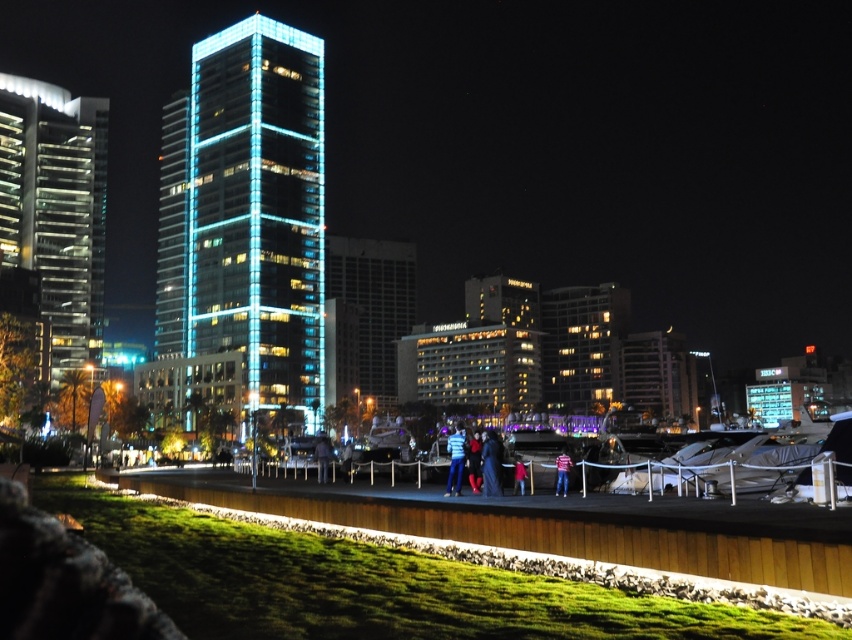
Who is shorter, glassy reflective skyscraper at left or velvet black dress at center?

Standing shorter between the two is velvet black dress at center.

This screenshot has height=640, width=852. Describe the element at coordinates (56, 209) in the screenshot. I see `glassy reflective skyscraper at left` at that location.

This screenshot has height=640, width=852. I want to click on glassy reflective skyscraper at left, so click(x=56, y=209).

Does blue denim jeans at center have a lesser width compared to dark blue jeans at center?

Incorrect, blue denim jeans at center's width is not less than dark blue jeans at center's.

Which is in front, point (461, 440) or point (320, 476)?

Point (461, 440) is in front.

Where is `blue denim jeans at center`? This screenshot has height=640, width=852. blue denim jeans at center is located at coordinates [455, 458].

Which is above, blue glassy tower at center or pink striped shirt at center?

Positioned higher is blue glassy tower at center.

Who is positioned more to the left, blue glassy tower at center or pink striped shirt at center?

blue glassy tower at center is more to the left.

Find the location of `blue glassy tower at center`. blue glassy tower at center is located at coordinates (242, 227).